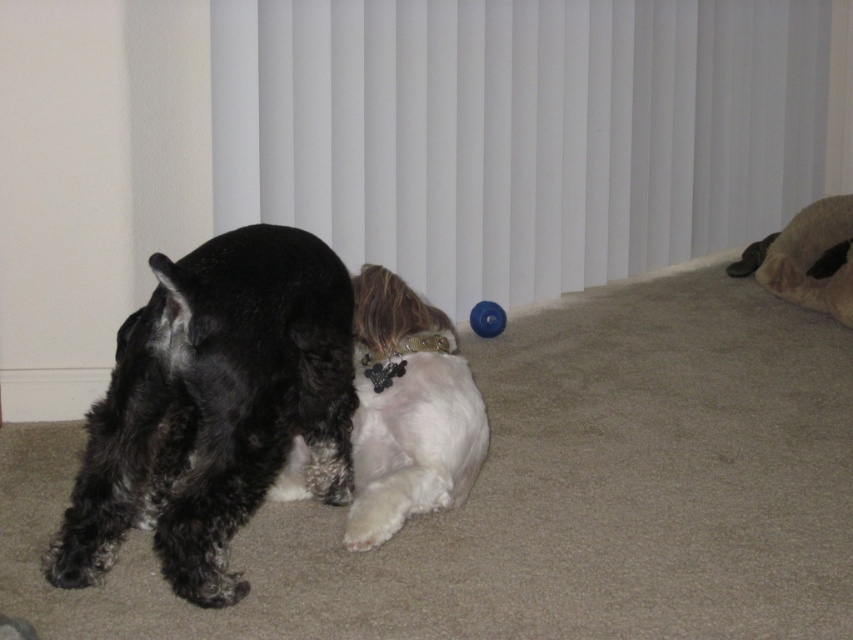
Does white plastic blinds at upper center have a greater width compared to blue rubber ball at center?

Yes, white plastic blinds at upper center is wider than blue rubber ball at center.

Does point (692, 196) lie in front of point (469, 324)?

No, (692, 196) is further to viewer.

The width and height of the screenshot is (853, 640). Describe the element at coordinates (527, 131) in the screenshot. I see `white plastic blinds at upper center` at that location.

Find the location of `white plastic blinds at upper center`. white plastic blinds at upper center is located at coordinates (527, 131).

The image size is (853, 640). Describe the element at coordinates (527, 131) in the screenshot. I see `white plastic blinds at upper center` at that location.

Does white plastic blinds at upper center lie behind white fluffy dog at center?

Yes, it is behind white fluffy dog at center.

Which is behind, point (268, 209) or point (463, 499)?

The point (268, 209) is more distant.

Find the location of a particular element. The height and width of the screenshot is (640, 853). white plastic blinds at upper center is located at coordinates (527, 131).

Is white plastic blinds at upper center to the right of shiny black fur at left from the viewer's perspective?

Correct, you'll find white plastic blinds at upper center to the right of shiny black fur at left.

Who is higher up, white plastic blinds at upper center or shiny black fur at left?

white plastic blinds at upper center is higher up.

Which is behind, point (509, 276) or point (195, 548)?

Positioned behind is point (509, 276).

This screenshot has width=853, height=640. I want to click on white plastic blinds at upper center, so click(x=527, y=131).